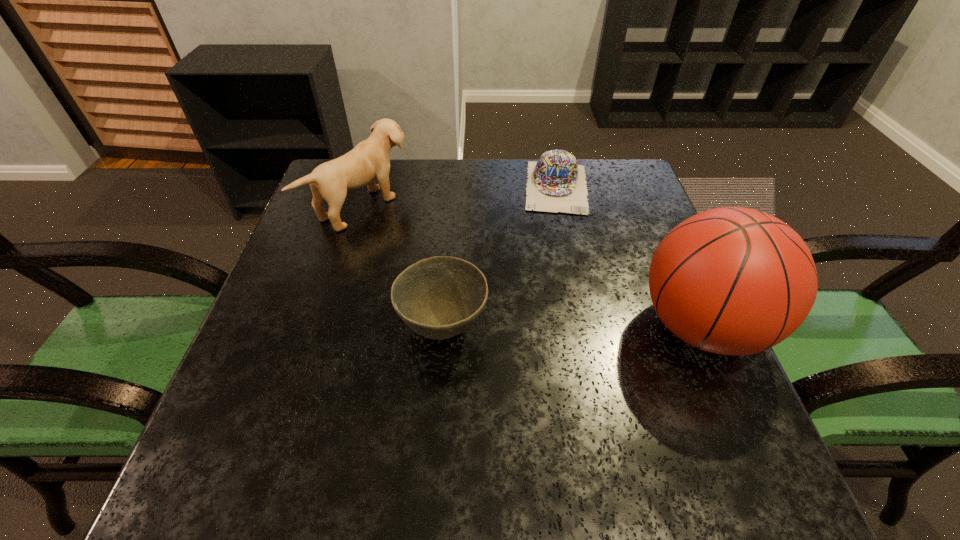
This screenshot has width=960, height=540. I want to click on cap located at the right edge, so click(556, 183).

Identify the location of object situated at the far left corner. (369, 159).

This screenshot has height=540, width=960. I want to click on object located in the far right corner section of the desktop, so click(x=556, y=183).

I want to click on vacant area at the far edge, so click(392, 163).

The height and width of the screenshot is (540, 960). In order to click on vacant space at the near edge in this screenshot , I will do `click(403, 433)`.

The height and width of the screenshot is (540, 960). I want to click on vacant space at the left edge of the desktop, so click(267, 310).

Find the location of a particular element. free region at the right edge of the desktop is located at coordinates (633, 217).

Find the location of `free location at the near left corner`. free location at the near left corner is located at coordinates (233, 413).

In the image, there is a desktop. Identify the location of blank space at the near right corner. (735, 409).

Locate an element on the screen. free spot between the shortest object and the rightmost object is located at coordinates (629, 257).